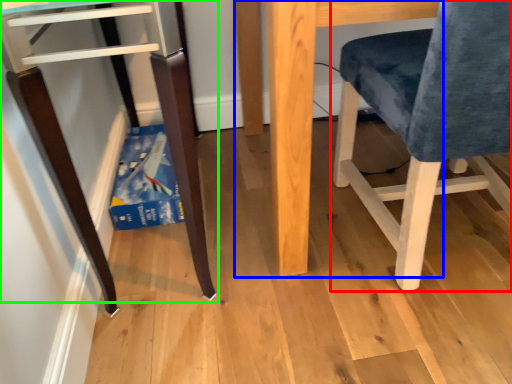
Question: Which object is the farthest from chair (highlighted by a red box)? Choose among these: table (highlighted by a blue box) or furniture (highlighted by a green box).

Choices:
 (A) table
 (B) furniture

Answer: (B)